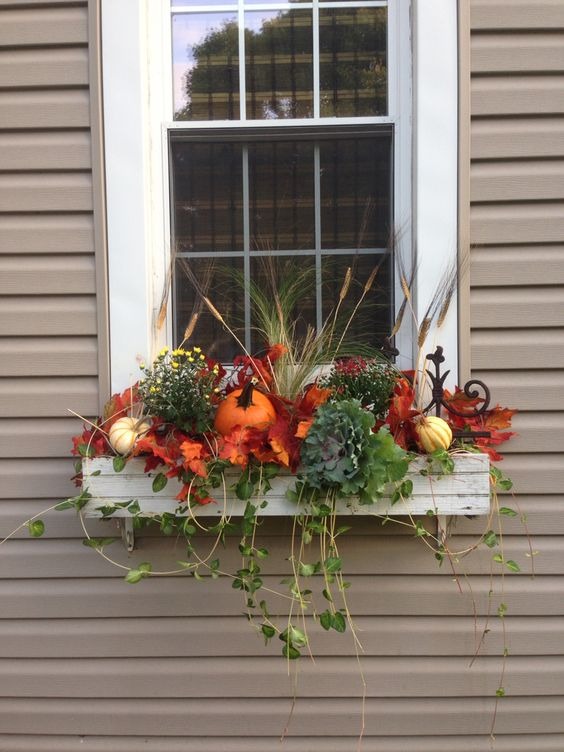
Find the location of a particular element. The width and height of the screenshot is (564, 752). window mullions is located at coordinates (315, 70), (248, 249).